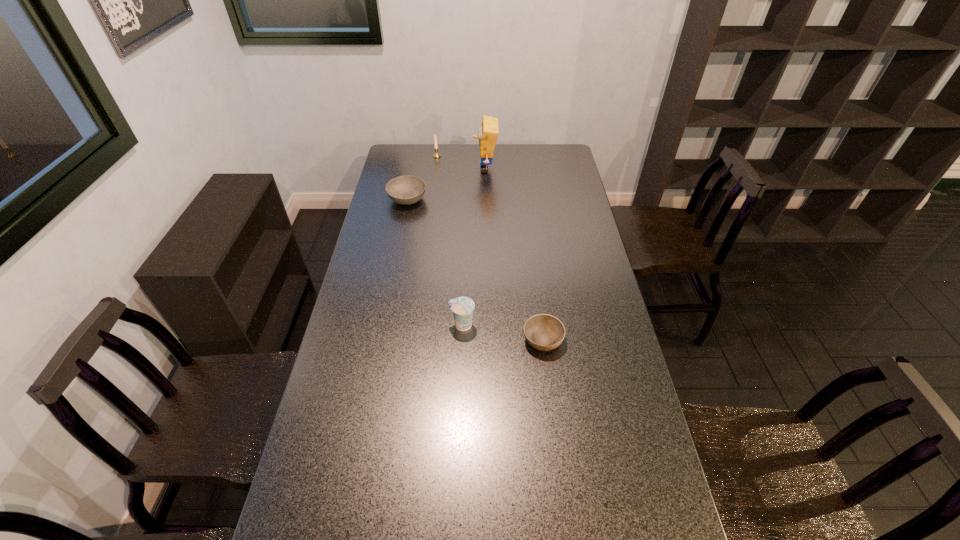
Image resolution: width=960 pixels, height=540 pixels. I want to click on sponge, so click(488, 132).

At what (x,y) coordinates should I click in order to perform the action: click on the fourth shortest object. Please return your answer as a coordinate pair (x, y). The height and width of the screenshot is (540, 960). Looking at the image, I should click on (436, 155).

In order to click on yogurt in this screenshot , I will do `click(462, 307)`.

At what (x,y) coordinates should I click in order to perform the action: click on the farther bowl. Please return your answer as a coordinate pair (x, y). This screenshot has width=960, height=540. Looking at the image, I should click on (406, 190).

The width and height of the screenshot is (960, 540). In order to click on the third farthest object in this screenshot , I will do `click(406, 190)`.

At what (x,y) coordinates should I click in order to perform the action: click on the shorter bowl. Please return your answer as a coordinate pair (x, y). Image resolution: width=960 pixels, height=540 pixels. Looking at the image, I should click on (544, 332).

At what (x,y) coordinates should I click in order to perform the action: click on the nearer bowl. Please return your answer as a coordinate pair (x, y). Image resolution: width=960 pixels, height=540 pixels. Looking at the image, I should click on (544, 332).

Locate an element on the screen. The height and width of the screenshot is (540, 960). free space located 0.360m on the face of the sponge is located at coordinates (400, 169).

At what (x,y) coordinates should I click in order to perform the action: click on blank space located 0.080m on the face of the sponge. Please return your answer as a coordinate pair (x, y). Looking at the image, I should click on (457, 169).

The image size is (960, 540). I want to click on vacant space situated on the face of the sponge, so coord(435,169).